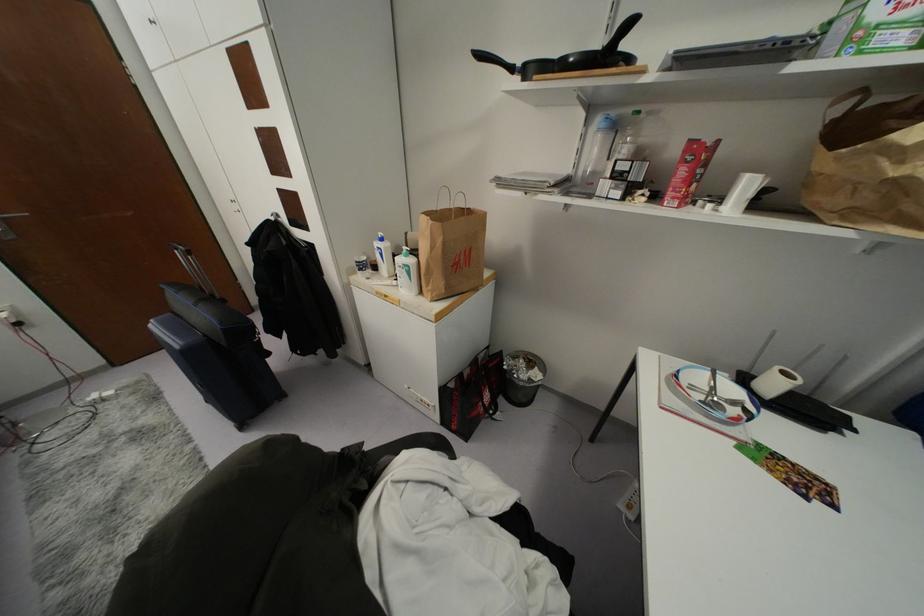
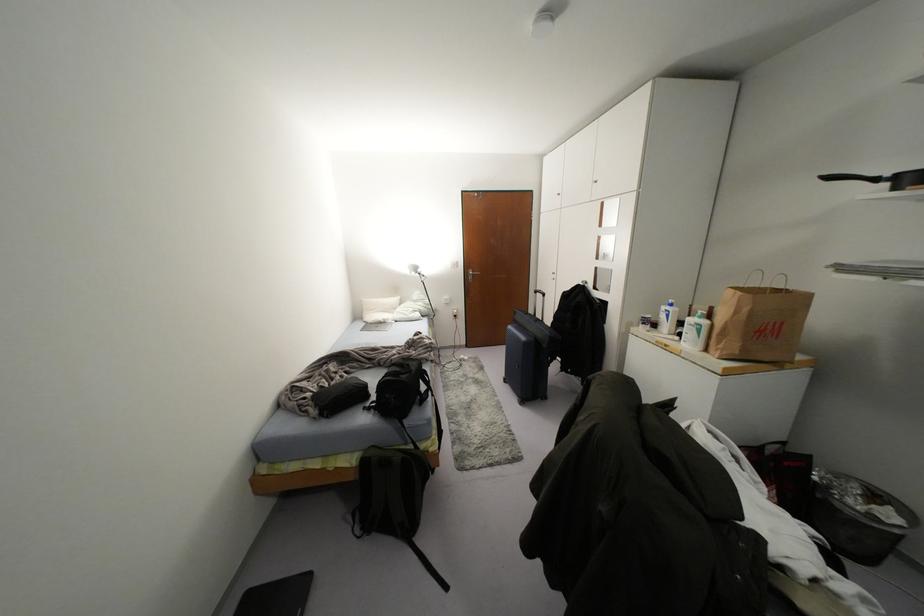
In the second image, find the point that corresponds to [381,254] in the first image.

(666, 315)